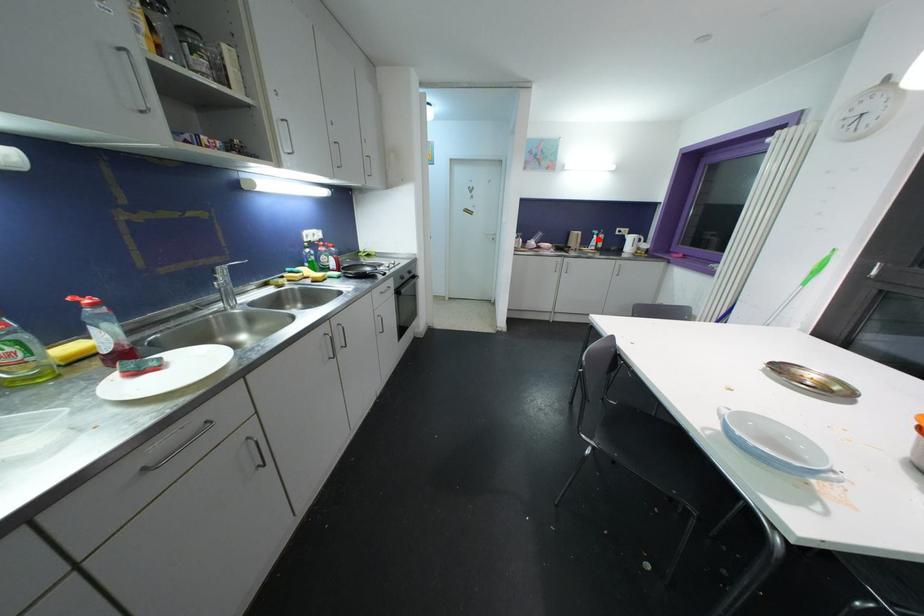
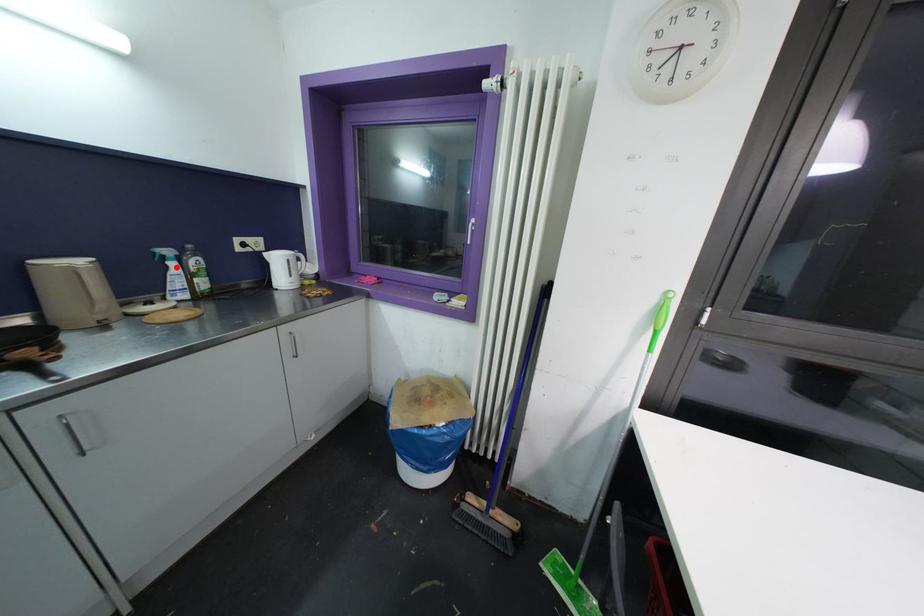
I am providing you with two images of the same scene from different viewpoints. A red point is marked on the first image and another point is marked on the second image. Do the highlighted points in image1 and image2 indicate the same real-world spot?

Yes